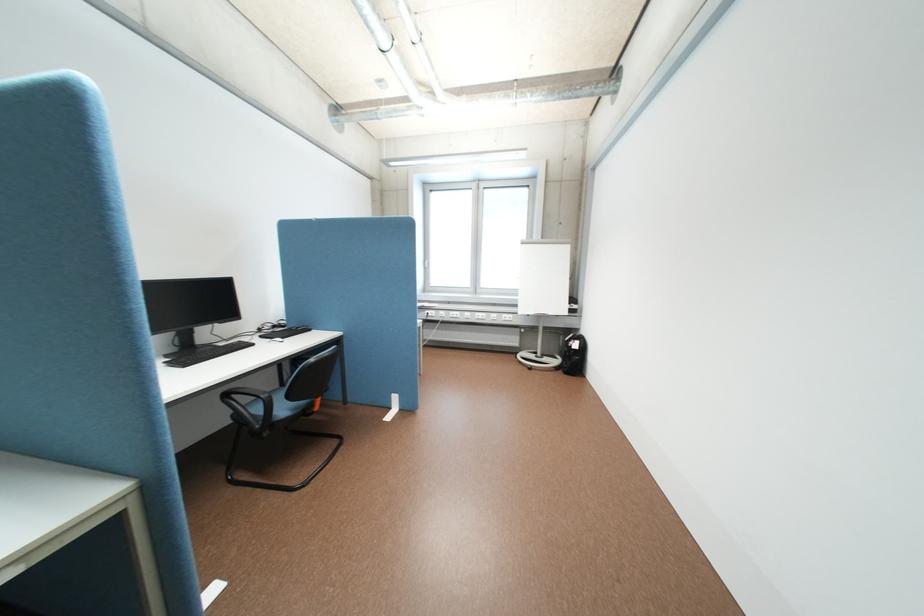
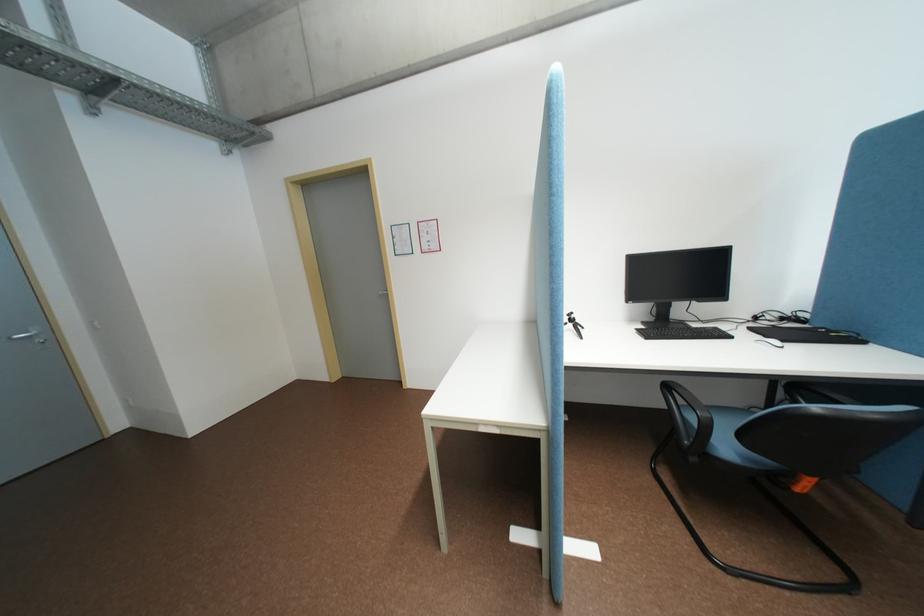
The point at (187,349) is marked in the first image. Where is the corresponding point in the second image?

(662, 318)